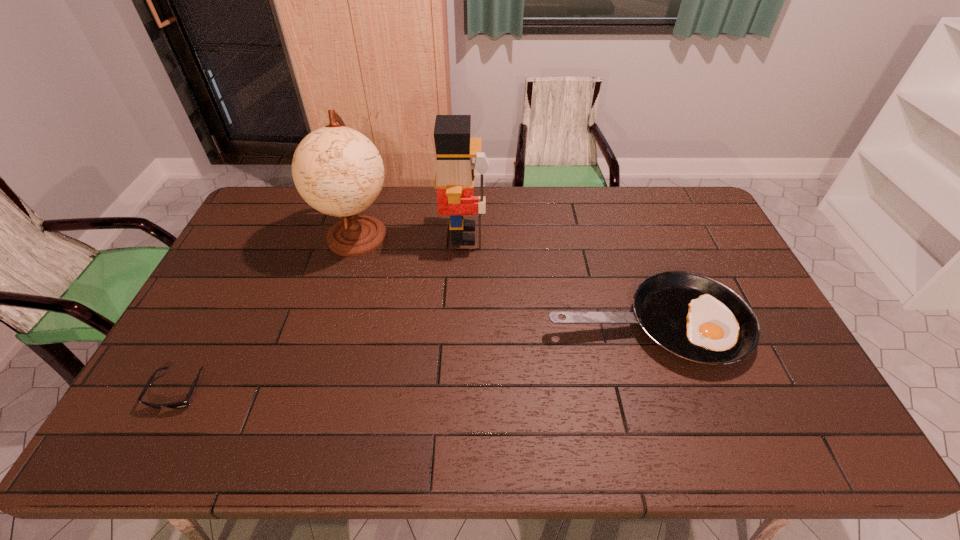
Find the location of `the third object from right to left`. the third object from right to left is located at coordinates (338, 171).

Identify the location of nutcracker. The image size is (960, 540). (455, 172).

The height and width of the screenshot is (540, 960). Find the location of `the third tallest object`. the third tallest object is located at coordinates (695, 318).

In order to click on frying pan in this screenshot , I will do `click(695, 318)`.

The image size is (960, 540). In order to click on the shortest object in this screenshot , I will do `click(184, 403)`.

Find the location of a particular element. sunglasses is located at coordinates (184, 403).

Image resolution: width=960 pixels, height=540 pixels. I want to click on free space located 0.240m on the surface of the third object from right to left, so click(331, 325).

Locate an element on the screen. Image resolution: width=960 pixels, height=540 pixels. vacant space situated 0.210m in front of the third object from left to right holding the staff is located at coordinates (548, 235).

The height and width of the screenshot is (540, 960). In order to click on vacant space located 0.290m on the back of the rightmost object in this screenshot , I will do `click(612, 223)`.

Where is `free spot located 0.100m on the front-facing side of the sunglasses`? The width and height of the screenshot is (960, 540). free spot located 0.100m on the front-facing side of the sunglasses is located at coordinates (146, 453).